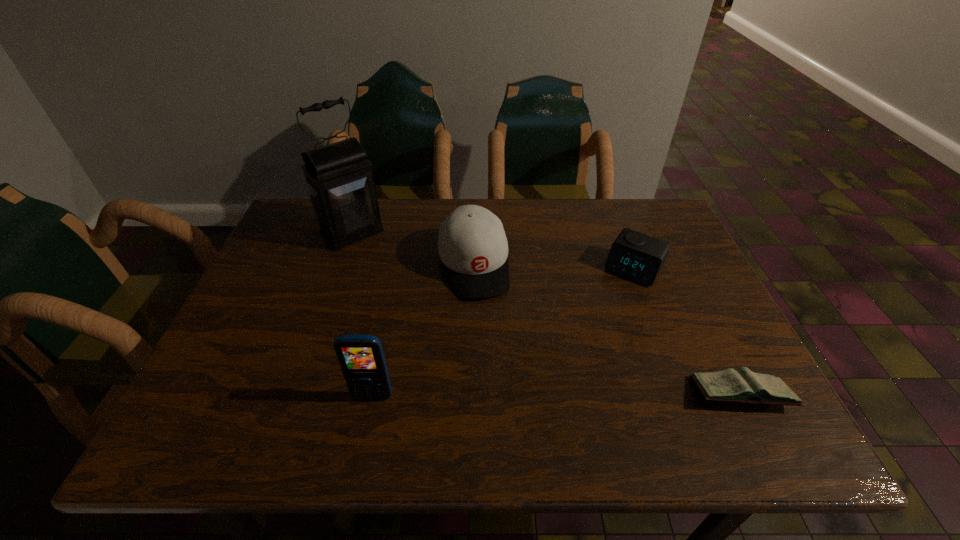
Locate an element on the screen. Image resolution: width=960 pixels, height=540 pixels. free spot on the desktop that is between the fourth shortest object and the shortest object and is positioned on the front-facing side of the fourth tallest object is located at coordinates (553, 395).

This screenshot has width=960, height=540. Find the location of `free space on the desktop that is between the cellular telephone and the shortest object and is positioned on the front-facing side of the baseball cap`. free space on the desktop that is between the cellular telephone and the shortest object and is positioned on the front-facing side of the baseball cap is located at coordinates (510, 396).

You are a GUI agent. You are given a task and a screenshot of the screen. Output one action in this format:
    pyautogui.click(x=<x>, y=<y>)
    Task: Click on the vacant space on the desktop that is between the cellular telephone and the diary and is positioned on the front-facing side of the tallest object
    The height and width of the screenshot is (540, 960).
    Given the screenshot: What is the action you would take?
    (x=504, y=396)